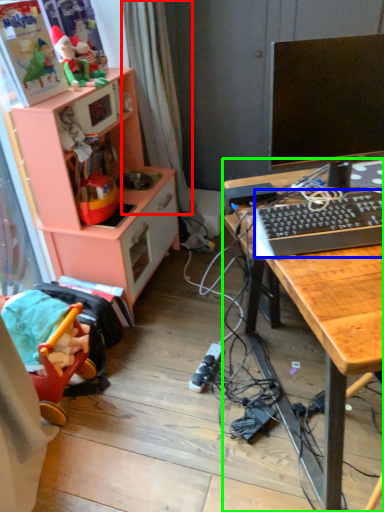
Question: Considering the real-world distances, which object is closest to curtain (highlighted by a red box)? computer keyboard (highlighted by a blue box) or desk (highlighted by a green box).

Choices:
 (A) computer keyboard
 (B) desk

Answer: (A)